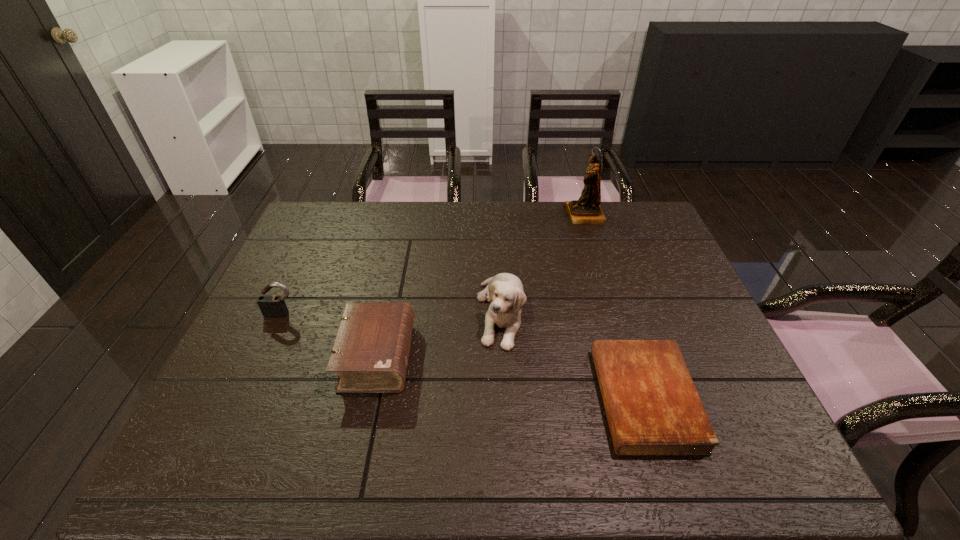
Find the location of a particular element. The width and height of the screenshot is (960, 540). the farthest object is located at coordinates (587, 210).

I want to click on figurine, so click(587, 210).

Find the location of a particular element. The image size is (960, 540). puppy is located at coordinates (505, 293).

Find the location of a particular element. The width and height of the screenshot is (960, 540). the second tallest object is located at coordinates (505, 293).

Identify the location of the leftmost object. (272, 306).

Identify the location of padlock. The image size is (960, 540). (272, 306).

At what (x,y) coordinates should I click in order to perform the action: click on the fourth object from right to left. Please return your answer as a coordinate pair (x, y). The width and height of the screenshot is (960, 540). Looking at the image, I should click on (370, 354).

I want to click on the taller Bible, so click(370, 354).

Identify the location of the right Bible. This screenshot has width=960, height=540. (652, 406).

The height and width of the screenshot is (540, 960). I want to click on the shorter Bible, so click(652, 406).